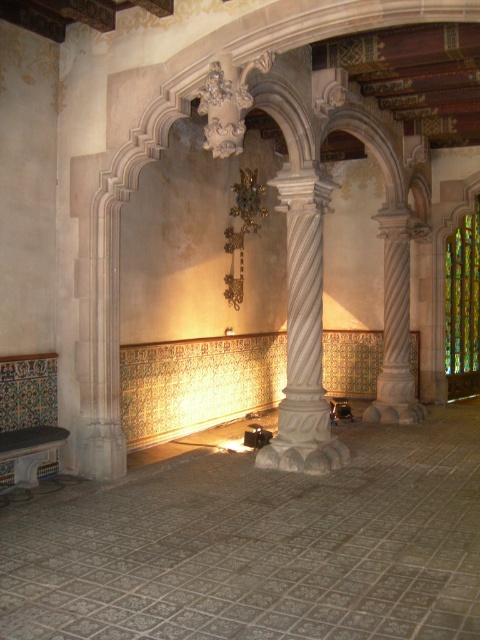
You are an architect analyzing the interior space. You need to determine if the white marble column at center can support a decorative sculpture that weighs as much as the multicolored stained glass at right. Based on their sizes, what would you advise?

The white marble column at center is smaller than the multicolored stained glass at right. Since the column is smaller, it may not have the structural capacity to support the same weight as the stained glass, so it is advisable to avoid placing a similarly heavy sculpture on it.

You are an architect planning to install a new decorative light fixture in this historical space. The light fixture requires a mounting point that is at least 1.2 meters away from the white marble column at center to avoid damaging the historical structure. Given the column is at coordinates point 0.519, 0.633, can you determine if the proposed mounting location at point 0.45, 0.6 is within the safe distance?

The white marble column at center is located at point (303,332). The proposed mounting location at point (288,288) would need to be checked for distance. However, without knowing the scale of the coordinate system, it is impossible to determine if the 1.2 meters requirement is met. Please provide the scale of the coordinates to calculate the actual distance.

You are standing in the historical building and want to take a photo of the multicolored stained glass at right without the white marble column at center blocking the view. Is this possible?

The white marble column at center is in front of the multicolored stained glass at right, so it will block the view. To take a photo of the multicolored stained glass at right without the column, you would need to move to a position where the column is out of the frame or behind you.